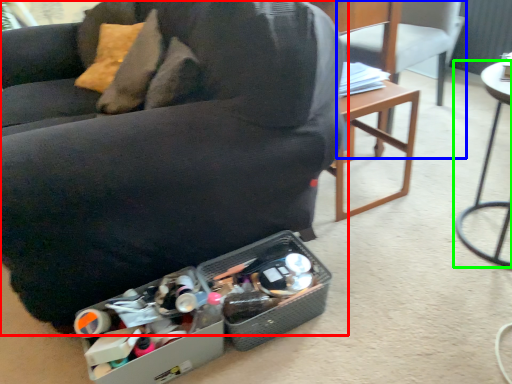
Question: Which is farther away from chair (highlighted by a red box)? chair (highlighted by a blue box) or table (highlighted by a green box)?

Choices:
 (A) chair
 (B) table

Answer: (A)